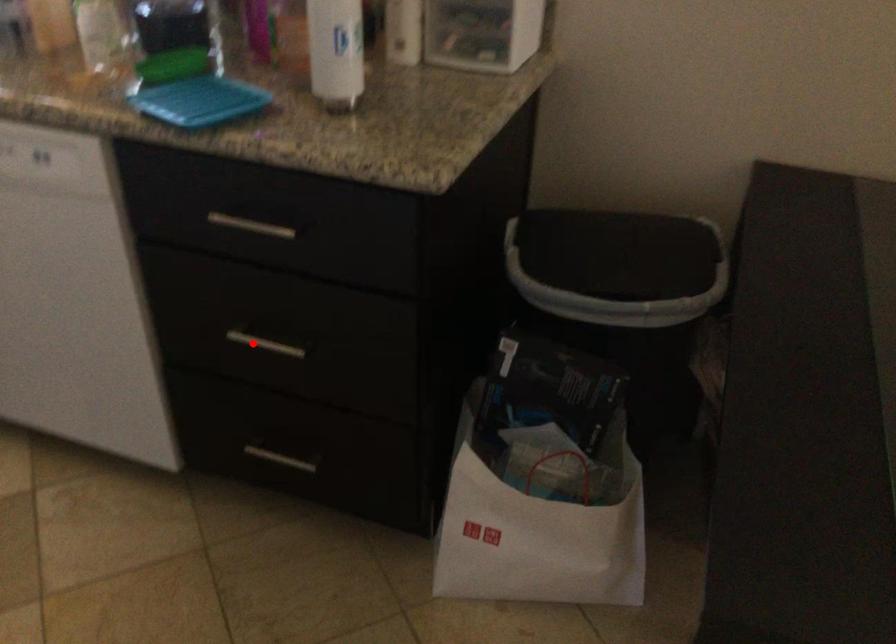
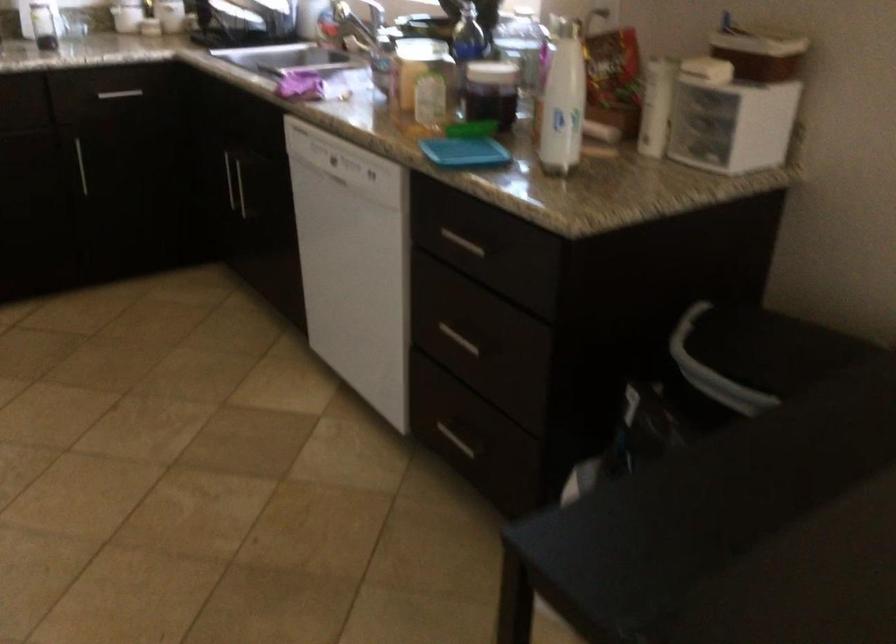
Question: I am providing you with two images of the same scene from different viewpoints. Image1 has a red point marked. In image2, the corresponding 3D location appears at what relative position? Reply with the corresponding letter.

Choices:
 (A) Closer
 (B) Farther

Answer: (B)